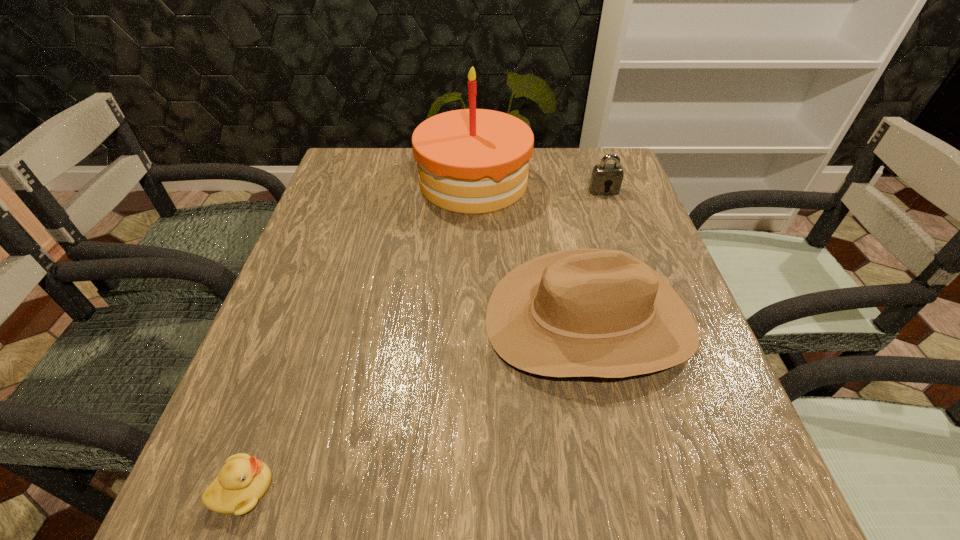
At what (x,y) coordinates should I click in order to perform the action: click on vacant area between the second shortest object and the nearest object. Please return your answer as a coordinate pair (x, y). Looking at the image, I should click on (423, 340).

The image size is (960, 540). In order to click on free space between the birthday cake and the second shortest object in this screenshot , I will do `click(539, 186)`.

I want to click on free area in between the tallest object and the cowboy hat, so click(532, 251).

Locate an element on the screen. free point between the third farthest object and the nearest object is located at coordinates (417, 404).

I want to click on object that is the closest one to the tallest object, so click(605, 177).

Identify which object is the third closest to the birthday cake. Please provide its 2D coordinates. Your answer should be formatted as a tuple, i.e. [(x, y)], where the tuple contains the x and y coordinates of a point satisfying the conditions above.

[(243, 480)]

Where is `free space that satisfies the following two spatial constraints: 1. at the front of the padlock near the keyhole; 2. on the beak of the shortest object`? The image size is (960, 540). free space that satisfies the following two spatial constraints: 1. at the front of the padlock near the keyhole; 2. on the beak of the shortest object is located at coordinates (708, 489).

Where is `vacant area that satisfies the following two spatial constraints: 1. at the front of the padlock near the keyhole; 2. on the beak of the shortest object`? The image size is (960, 540). vacant area that satisfies the following two spatial constraints: 1. at the front of the padlock near the keyhole; 2. on the beak of the shortest object is located at coordinates (708, 489).

Find the location of `vacant region that satisfies the following two spatial constraints: 1. at the front of the second shortest object near the keyhole; 2. on the beak of the leftmost object`. vacant region that satisfies the following two spatial constraints: 1. at the front of the second shortest object near the keyhole; 2. on the beak of the leftmost object is located at coordinates (708, 489).